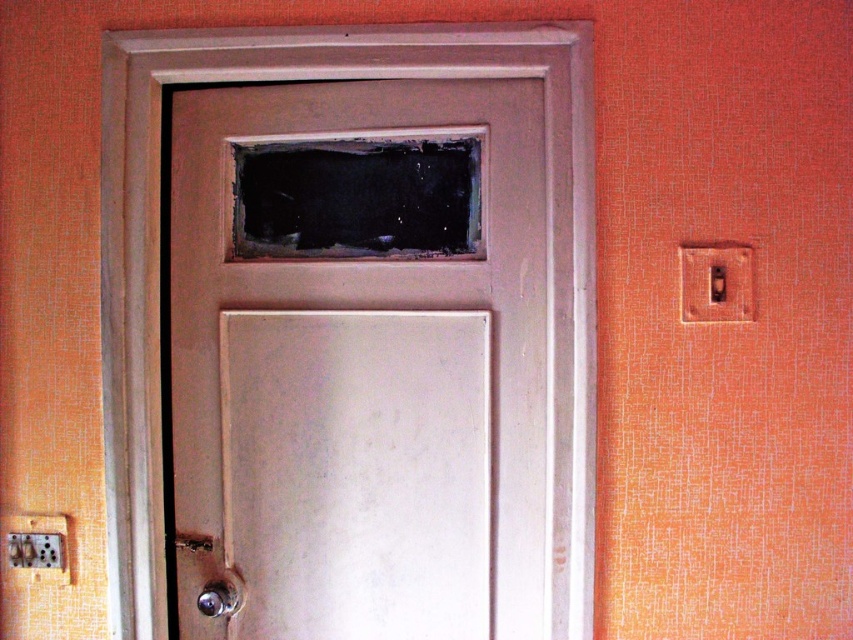
Is matte wood door at center above polished silver knob at lower left?

Yes.

Which is behind, point (451, 77) or point (229, 600)?

The point (229, 600) is behind.

This screenshot has height=640, width=853. I want to click on matte wood door at center, so click(x=158, y=273).

Can you confirm if matte wood door at center is positioned below metallic silver door handle at lower left?

Actually, matte wood door at center is above metallic silver door handle at lower left.

Which of these two, matte wood door at center or metallic silver door handle at lower left, stands shorter?

With less height is metallic silver door handle at lower left.

Is point (109, 342) farther from viewer compared to point (189, 536)?

That is False.

The height and width of the screenshot is (640, 853). Find the location of `matte wood door at center`. matte wood door at center is located at coordinates [158, 273].

Does polished silver knob at lower left lie behind metallic silver door handle at lower left?

No, polished silver knob at lower left is in front of metallic silver door handle at lower left.

Identify the location of polished silver knob at lower left. This screenshot has width=853, height=640. (221, 596).

I want to click on polished silver knob at lower left, so click(221, 596).